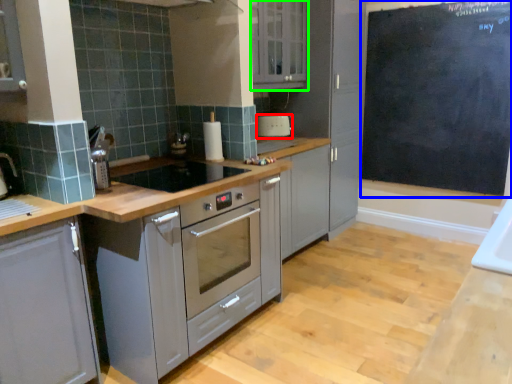
Question: Which is farther away from home appliance (highlighted by a red box)? bulletin board (highlighted by a blue box) or cabinetry (highlighted by a green box)?

Choices:
 (A) bulletin board
 (B) cabinetry

Answer: (A)